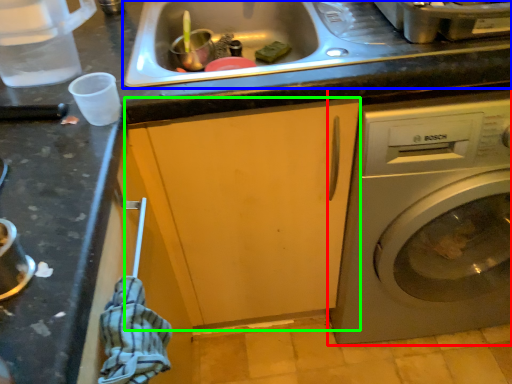
Question: Considering the real-world distances, which object is closest to washing machine (highlighted by a red box)? sink (highlighted by a blue box) or cabinetry (highlighted by a green box).

Choices:
 (A) sink
 (B) cabinetry

Answer: (B)